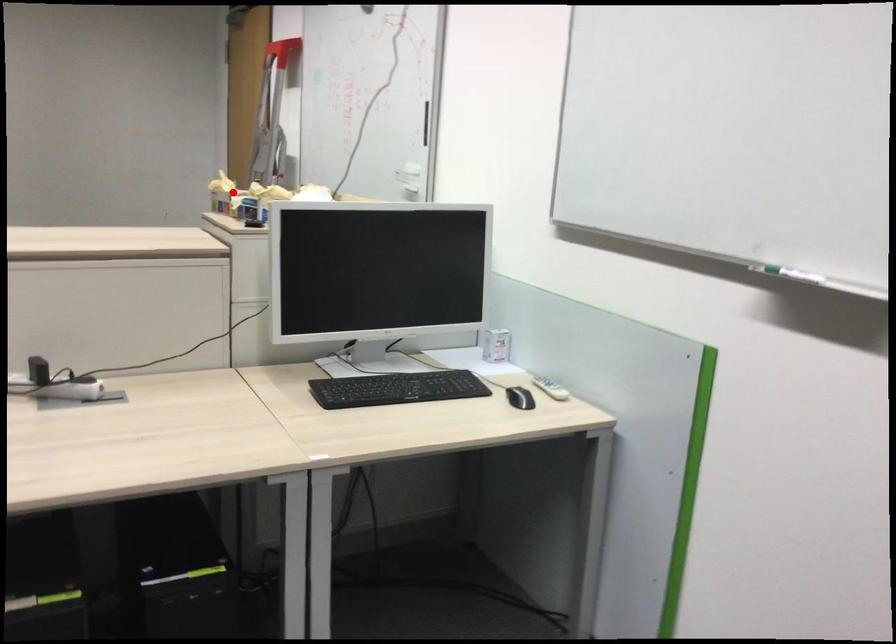
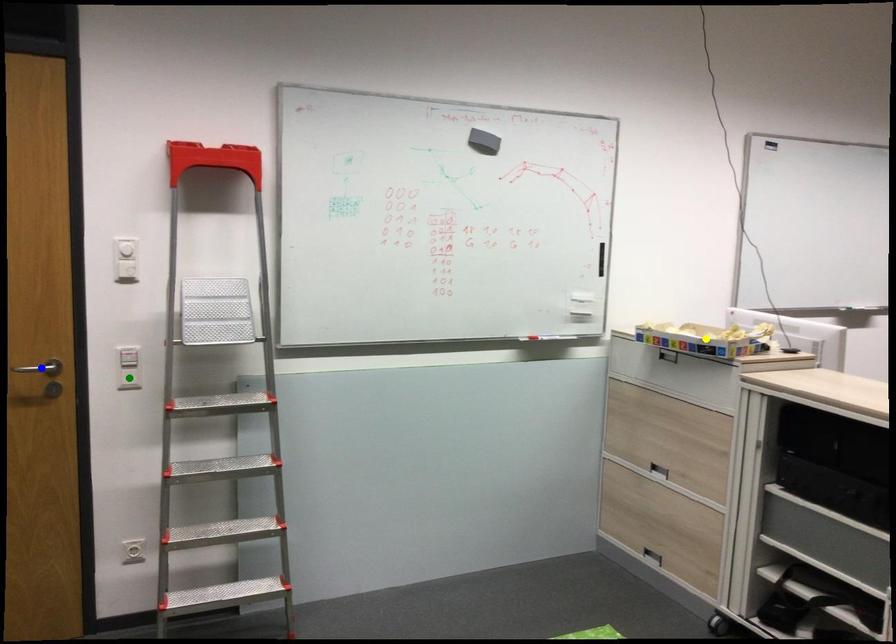
Question: I am providing you with two images of the same scene from different viewpoints. A red point is marked on the first image. You are given multiple points on the second image. Can you choose the point in image 2 that corresponds to the point in image 1?

Choices:
 (A) green point
 (B) blue point
 (C) yellow point

Answer: (C)